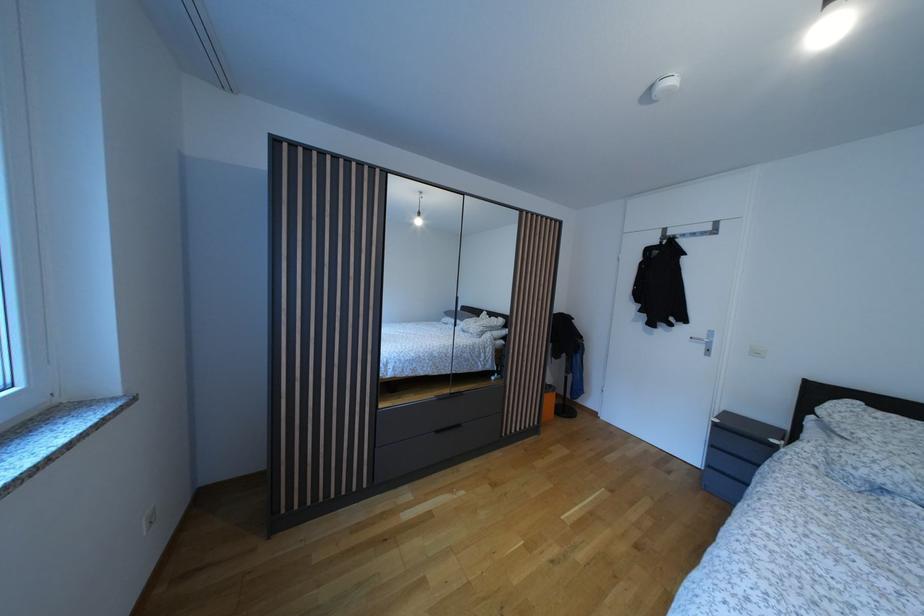
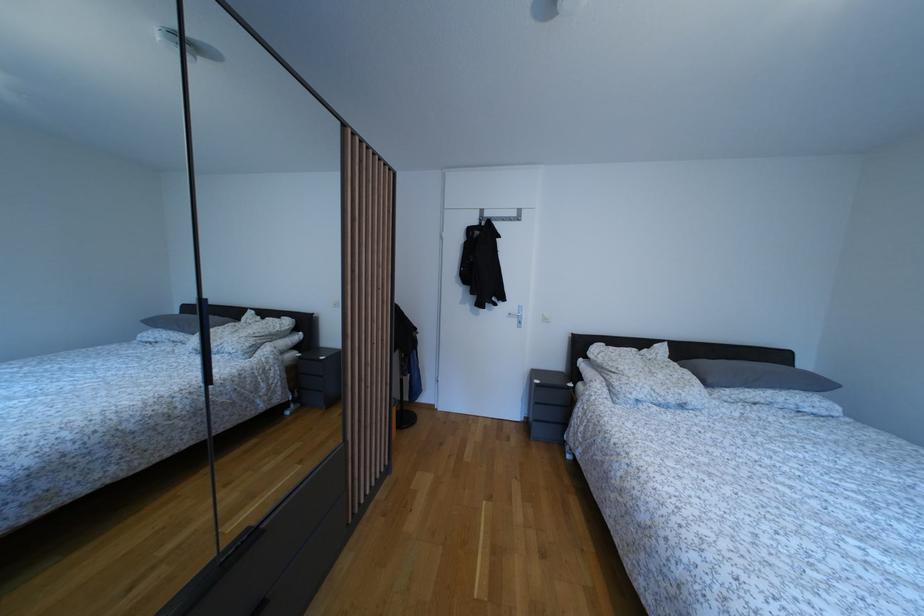
Question: How did the camera likely rotate?

Choices:
 (A) Left
 (B) Right
 (C) Up
 (D) Down

Answer: (B)